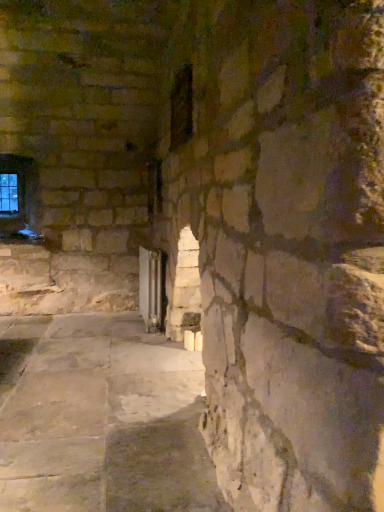
Question: Is dark glass window at center, marked as the 1th window in a right-to-left arrangement, taller or shorter than clear glass window at upper left, which is the second window in front-to-back order?

Choices:
 (A) tall
 (B) short

Answer: (B)

Question: Based on their sizes in the image, would you say dark glass window at center, the second window positioned from the back, is bigger or smaller than clear glass window at upper left, the 2th window when ordered from right to left?

Choices:
 (A) big
 (B) small

Answer: (A)

Question: Estimate the real-world distances between objects in this image. Which object is closer to the transparent glass door at center?

Choices:
 (A) clear glass window at upper left, the 1th window from the back
 (B) dark glass window at center, marked as the 1th window in a right-to-left arrangement

Answer: (B)

Question: Based on their relative distances, which object is nearer to the clear glass window at upper left, the 2th window when ordered from right to left?

Choices:
 (A) dark glass window at center, marked as the 2th window in a left-to-right arrangement
 (B) transparent glass door at center

Answer: (B)